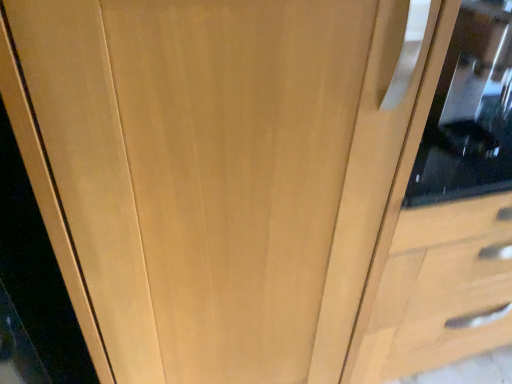
Identify the location of light wood/file cabinet at right. The width and height of the screenshot is (512, 384). (446, 209).

This screenshot has height=384, width=512. Describe the element at coordinates (446, 209) in the screenshot. I see `light wood/file cabinet at right` at that location.

This screenshot has height=384, width=512. What are the coordinates of `light wood/file cabinet at right` in the screenshot? It's located at (446, 209).